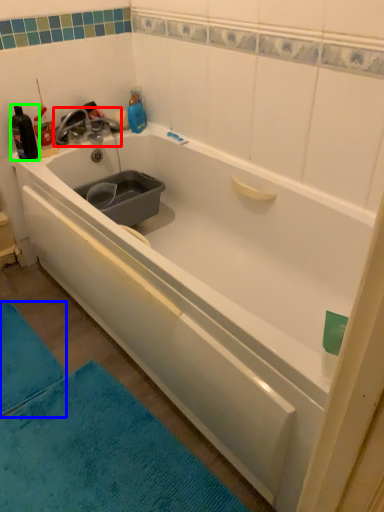
Question: Estimate the real-world distances between objects in this image. Which object is farther from tap (highlighted by a red box), bath mat (highlighted by a blue box) or bottle (highlighted by a green box)?

Choices:
 (A) bath mat
 (B) bottle

Answer: (A)